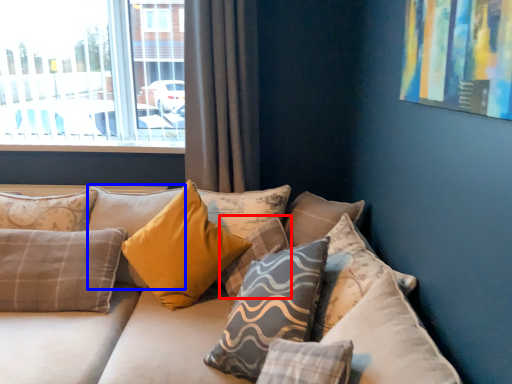
Question: Which object is further to the camera taking this photo, pillow (highlighted by a red box) or pillow (highlighted by a blue box)?

Choices:
 (A) pillow
 (B) pillow

Answer: (B)